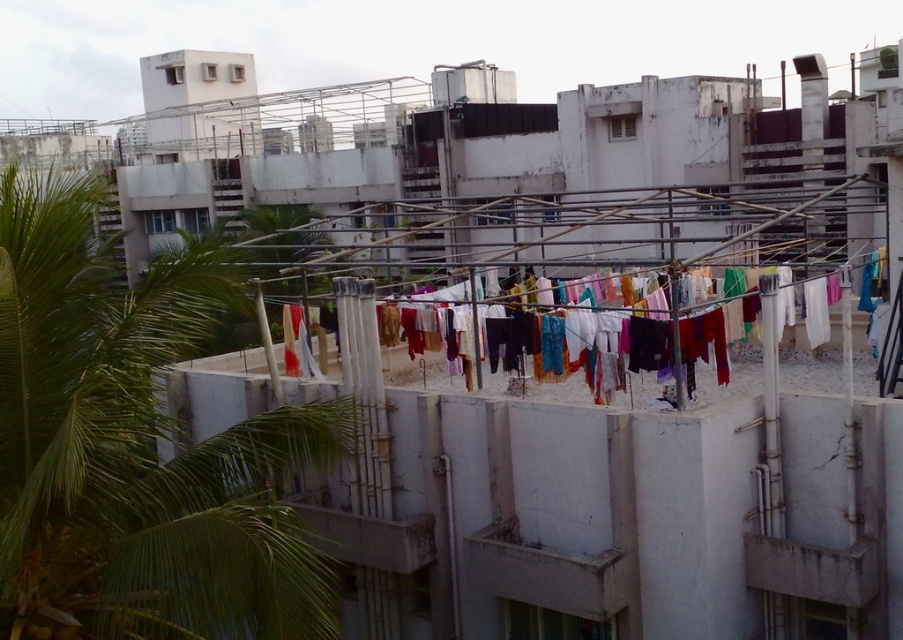
From the picture: Can you confirm if green leafy palm tree at upper left is taller than multicolored fabric at center?

Indeed, green leafy palm tree at upper left has a greater height compared to multicolored fabric at center.

Is green leafy palm tree at upper left bigger than multicolored fabric at center?

Yes.

Consider the image. Who is more forward, (215, 456) or (537, 387)?

Point (215, 456) is more forward.

At what (x,y) coordinates should I click in order to perform the action: click on green leafy palm tree at upper left. Please return your answer as a coordinate pair (x, y). This screenshot has height=640, width=903. Looking at the image, I should click on (137, 448).